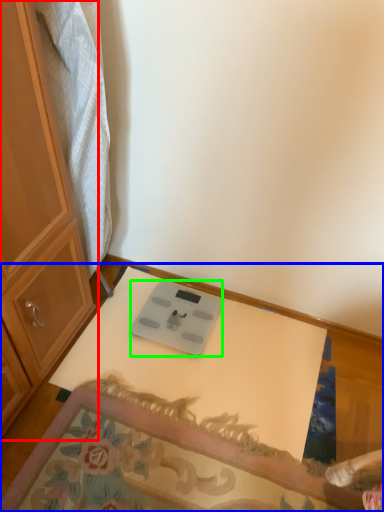
Question: Estimate the real-world distances between objects in this image. Which object is closer to cabinetry (highlighted by a red box), table (highlighted by a blue box) or weight scale (highlighted by a green box)?

Choices:
 (A) table
 (B) weight scale

Answer: (B)